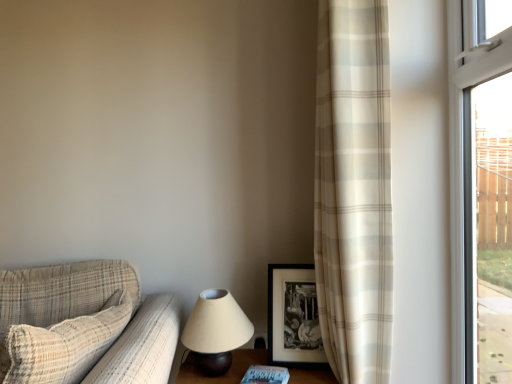
Question: Considering the positions of plaid fabric couch at left and white matte book at lower center in the image, is plaid fabric couch at left taller or shorter than white matte book at lower center?

Choices:
 (A) short
 (B) tall

Answer: (B)

Question: Based on their positions, is plaid fabric couch at left located to the left or right of white matte book at lower center?

Choices:
 (A) left
 (B) right

Answer: (A)

Question: Which is farther from the matte beige lampshade at lower center?

Choices:
 (A) beige plaid curtain at right
 (B) black matte picture frame at center-right
 (C) transparent glass window at right
 (D) white matte book at lower center
 (E) plaid fabric couch at left

Answer: (C)

Question: Which object is positioned farthest from the matte beige lampshade at lower center?

Choices:
 (A) beige plaid curtain at right
 (B) transparent glass window at right
 (C) plaid fabric couch at left
 (D) white matte book at lower center
 (E) black matte picture frame at center-right

Answer: (B)